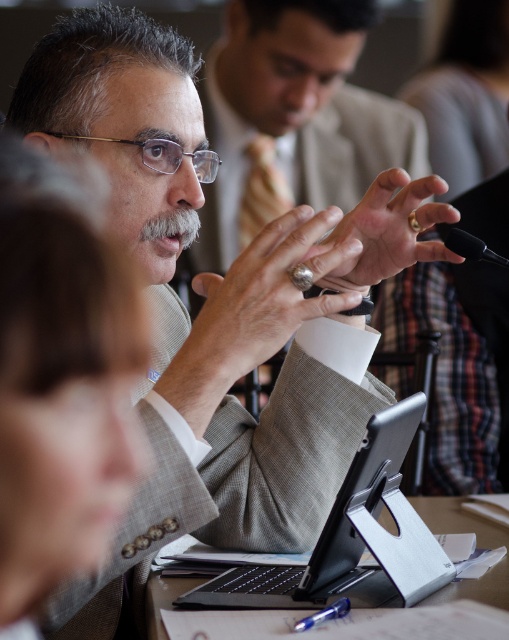
Looking at this image, who is positioned more to the right, black plastic tablet at center or black matte microphone at center?

Positioned to the right is black matte microphone at center.

Is black plastic tablet at center further to the viewer compared to black matte microphone at center?

No, it is not.

The width and height of the screenshot is (509, 640). In order to click on black plastic tablet at center in this screenshot , I will do tap(459, 518).

This screenshot has width=509, height=640. What are the coordinates of `black plastic tablet at center` in the screenshot? It's located at (459, 518).

Between black matte laptop at center and black matte microphone at center, which one is positioned lower?

Positioned lower is black matte laptop at center.

Is black matte laptop at center to the left of black matte microphone at center from the viewer's perspective?

Correct, you'll find black matte laptop at center to the left of black matte microphone at center.

Does point (433, 540) lie in front of point (450, 244)?

Yes, point (433, 540) is closer to viewer.

Where is `black matte laptop at center`? black matte laptop at center is located at coordinates (349, 538).

Does black matte laptop at center have a lesser height compared to black plastic tablet at center?

Incorrect, black matte laptop at center's height does not fall short of black plastic tablet at center's.

Describe the element at coordinates (349, 538) in the screenshot. The image size is (509, 640). I see `black matte laptop at center` at that location.

Identify the location of black matte laptop at center. The image size is (509, 640). (349, 538).